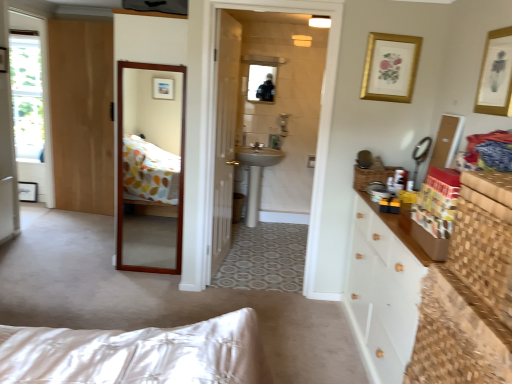
Locate an element on the screen. free point below translucent glass door at center, the 1th door positioned from the front (from a real-world perspective) is located at coordinates (220, 268).